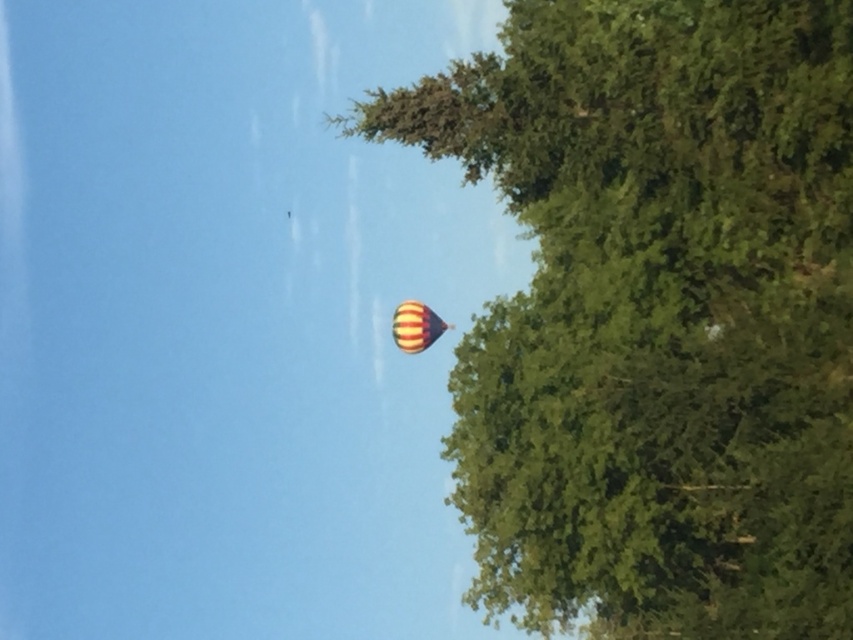
From the picture: Does green leafy tree at upper right have a greater height compared to striped fabric balloon at upper center?

Indeed, green leafy tree at upper right has a greater height compared to striped fabric balloon at upper center.

Is point (651, 604) positioned before point (409, 317)?

Yes, point (651, 604) is in front of point (409, 317).

The width and height of the screenshot is (853, 640). I want to click on green leafy tree at upper right, so click(x=656, y=314).